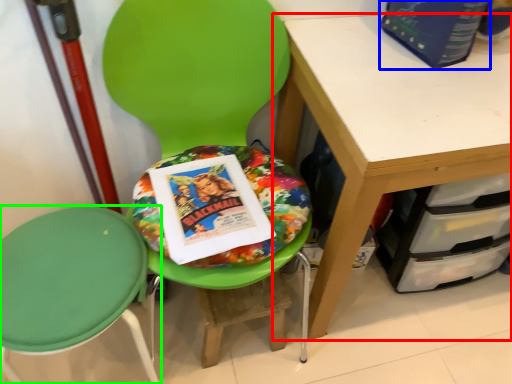
Question: Which object is positioned closest to desk (highlighted by a red box)? Select from paperback book (highlighted by a blue box) and chair (highlighted by a green box).

Choices:
 (A) paperback book
 (B) chair

Answer: (A)